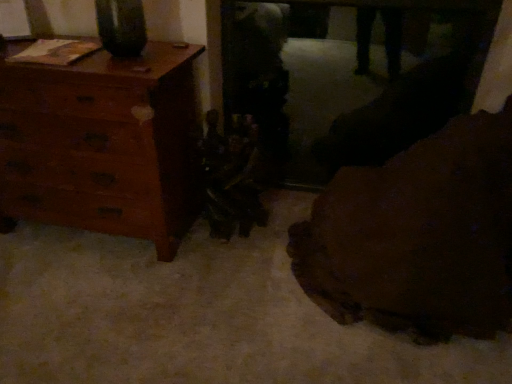
Question: From the image's perspective, is wooden dresser at left positioned above or below brown leather couch at lower right?

Choices:
 (A) above
 (B) below

Answer: (A)

Question: From their relative heights in the image, would you say wooden dresser at left is taller or shorter than brown leather couch at lower right?

Choices:
 (A) tall
 (B) short

Answer: (A)

Question: Is wooden dresser at left inside the boundaries of brown leather couch at lower right, or outside?

Choices:
 (A) outside
 (B) inside

Answer: (A)

Question: In terms of height, does brown leather couch at lower right look taller or shorter compared to wooden dresser at left?

Choices:
 (A) tall
 (B) short

Answer: (B)

Question: From the image's perspective, is brown leather couch at lower right above or below wooden dresser at left?

Choices:
 (A) above
 (B) below

Answer: (B)

Question: Considering the positions of brown leather couch at lower right and wooden dresser at left in the image, is brown leather couch at lower right bigger or smaller than wooden dresser at left?

Choices:
 (A) big
 (B) small

Answer: (A)

Question: Visually, is brown leather couch at lower right positioned to the left or to the right of wooden dresser at left?

Choices:
 (A) right
 (B) left

Answer: (A)